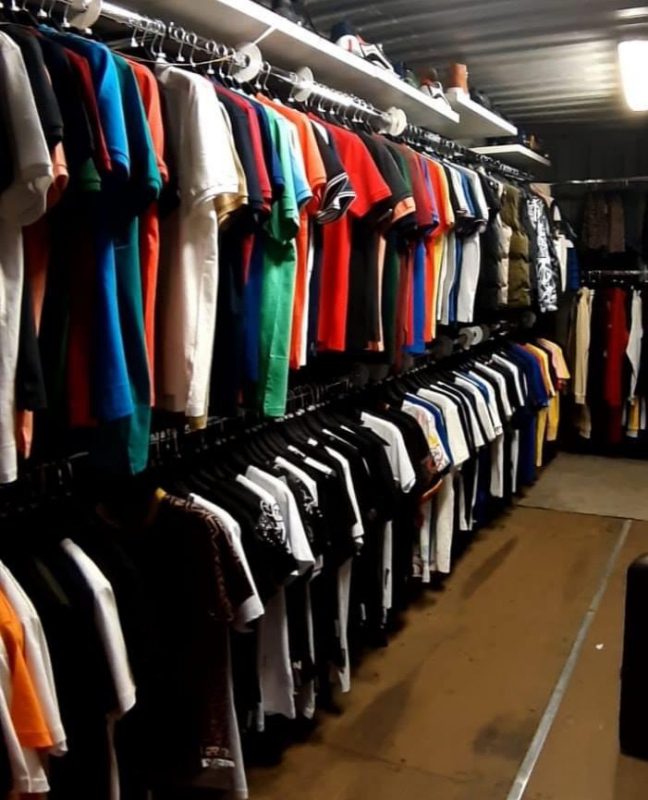
The image size is (648, 800). Identify the location of dividers. (87, 12), (244, 66), (301, 86), (397, 121), (487, 330), (479, 333), (465, 340), (365, 374), (385, 368), (408, 362).